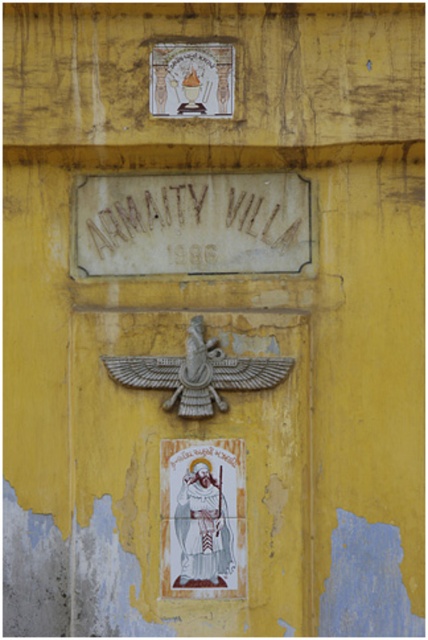
Locate an element on the screen. The width and height of the screenshot is (428, 640). brown stone sign at center is located at coordinates (190, 225).

Is point (256, 195) positioned in front of point (198, 490)?

No, it is behind (198, 490).

Image resolution: width=428 pixels, height=640 pixels. Find the location of `brown stone sign at center`. brown stone sign at center is located at coordinates point(190,225).

Where is `brown stone sign at center`? The height and width of the screenshot is (640, 428). brown stone sign at center is located at coordinates (190, 225).

Does brown stone sign at center have a greater width compared to matte white stone plaque at upper center?

Correct, the width of brown stone sign at center exceeds that of matte white stone plaque at upper center.

Who is taller, brown stone sign at center or matte white stone plaque at upper center?

brown stone sign at center is taller.

The image size is (428, 640). Find the location of `brown stone sign at center`. brown stone sign at center is located at coordinates (190, 225).

Does white glossy saint at center have a lesser height compared to matte white stone plaque at upper center?

No.

Does white glossy saint at center appear over matte white stone plaque at upper center?

No.

Describe the element at coordinates (202, 518) in the screenshot. The image size is (428, 640). I see `white glossy saint at center` at that location.

You are a GUI agent. You are given a task and a screenshot of the screen. Output one action in this format:
    pyautogui.click(x=<x>, y=<y>)
    Task: Click on the white glossy saint at center
    Image resolution: width=428 pixels, height=640 pixels.
    Given the screenshot: What is the action you would take?
    pyautogui.click(x=202, y=518)